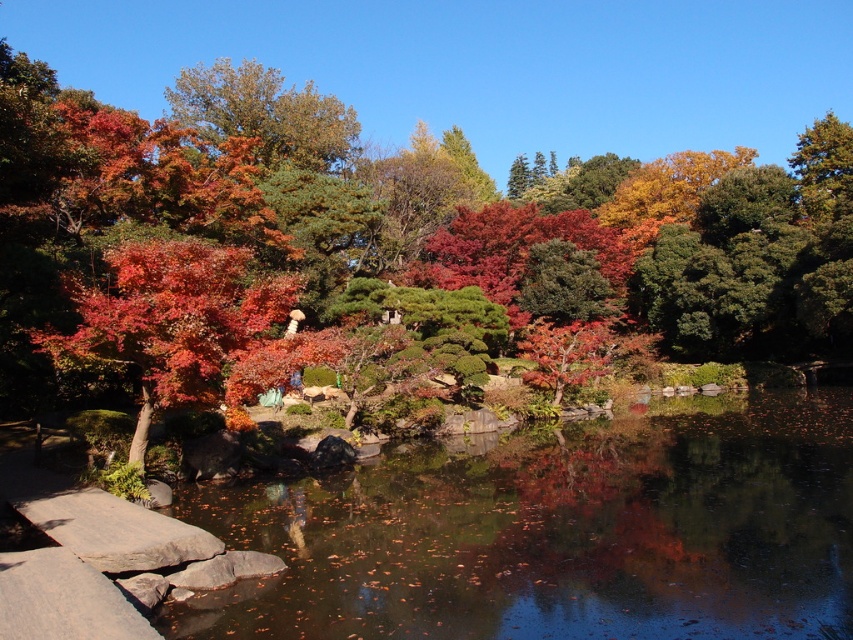
Can you confirm if glossy reflective water at center is taller than shiny red maple tree at center?

Correct, glossy reflective water at center is much taller as shiny red maple tree at center.

Describe the element at coordinates (556, 531) in the screenshot. Image resolution: width=853 pixels, height=640 pixels. I see `glossy reflective water at center` at that location.

In order to click on glossy reflective water at center in this screenshot , I will do `click(556, 531)`.